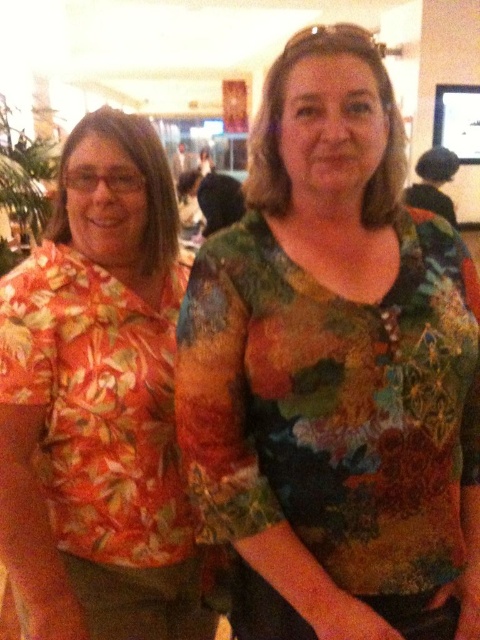
You are taking a photo of two people at an event. You want to focus on the floral fabric blouse at center and the orange floral shirt at left. Which one is closer to the camera?

The floral fabric blouse at center is closer to the viewer than the orange floral shirt at left, so the blouse would be in focus first.

You are organizing a clothing display and need to know which of the two items has a greater width. The items are the floral fabric blouse at center and the orange floral shirt at left. Can you determine which one is wider?

The floral fabric blouse at center has a larger width than the orange floral shirt at left according to the description.